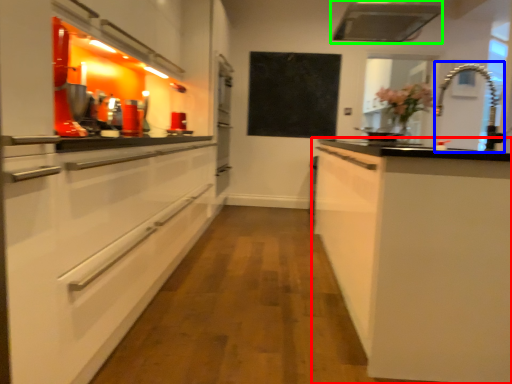
Question: Which is nearer to the cabinetry (highlighted by a red box)? faucet (highlighted by a blue box) or exhaust hood (highlighted by a green box).

Choices:
 (A) faucet
 (B) exhaust hood

Answer: (B)